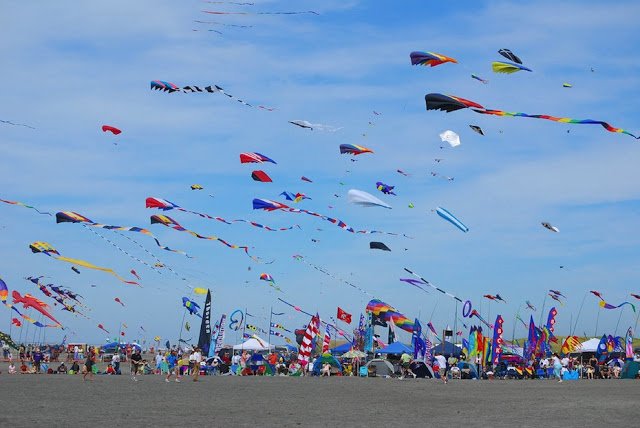
You are a GUI agent. You are given a task and a screenshot of the screen. Output one action in this format:
    pyautogui.click(x=<x>, y=<y>)
    Task: Click on the teal canopy
    The width and height of the screenshot is (640, 428).
    Given the screenshot: What is the action you would take?
    pyautogui.click(x=396, y=347)